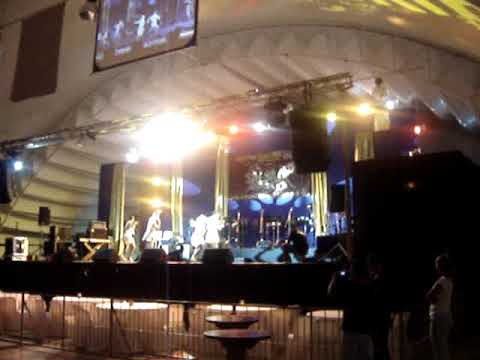
This screenshot has width=480, height=360. Find the location of `foot light`. foot light is located at coordinates (62, 254), (99, 255), (149, 258), (210, 258).